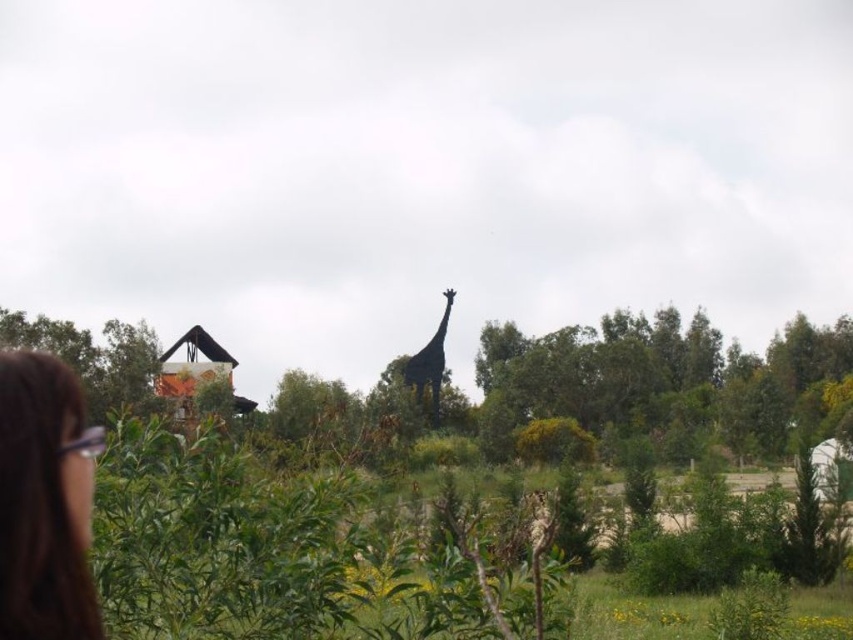
You are a photographer trying to capture both the brown hair at lower left and the shiny black giraffe at center in a single frame. Based on their sizes in the image, which one would appear larger in your photo?

The shiny black giraffe at center would appear larger in the photo since it is bigger than the brown hair at lower left.

You are a photographer trying to capture the giraffe in the midground. You notice a point at coordinates (44, 500) which is brown hair at lower left. Is this brown hair closer to the giraffe or the shelter?

The brown hair at lower left is closer to the shelter than the giraffe because the point is located at (44, 500), which is closer to the shelter.